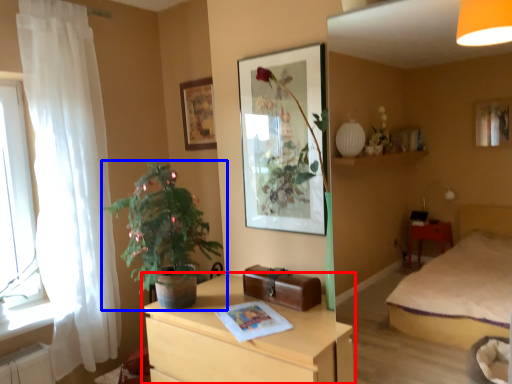
Question: Which of the following is the closest to the observer, chest of drawers (highlighted by a red box) or houseplant (highlighted by a blue box)?

Choices:
 (A) chest of drawers
 (B) houseplant

Answer: (A)